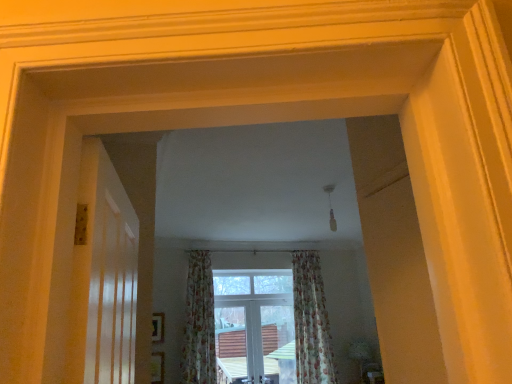
Question: Based on their positions, is floral fabric curtain at center, which is counted as the first curtain, starting from the right, located to the left or right of floral fabric curtain at center, the first curtain positioned from the left?

Choices:
 (A) left
 (B) right

Answer: (B)

Question: Looking at their shapes, would you say floral fabric curtain at center, which is counted as the first curtain, starting from the right, is wider or thinner than floral fabric curtain at center, arranged as the second curtain when viewed from the right?

Choices:
 (A) thin
 (B) wide

Answer: (A)

Question: Based on their relative distances, which object is farther from the clear glass window at center?

Choices:
 (A) floral fabric curtain at center, the first curtain positioned from the left
 (B) floral fabric curtain at center, which is counted as the second curtain, starting from the left

Answer: (A)

Question: Which is farther from the floral fabric curtain at center, the first curtain positioned from the left?

Choices:
 (A) clear glass window at center
 (B) floral fabric curtain at center, which is counted as the first curtain, starting from the right

Answer: (B)